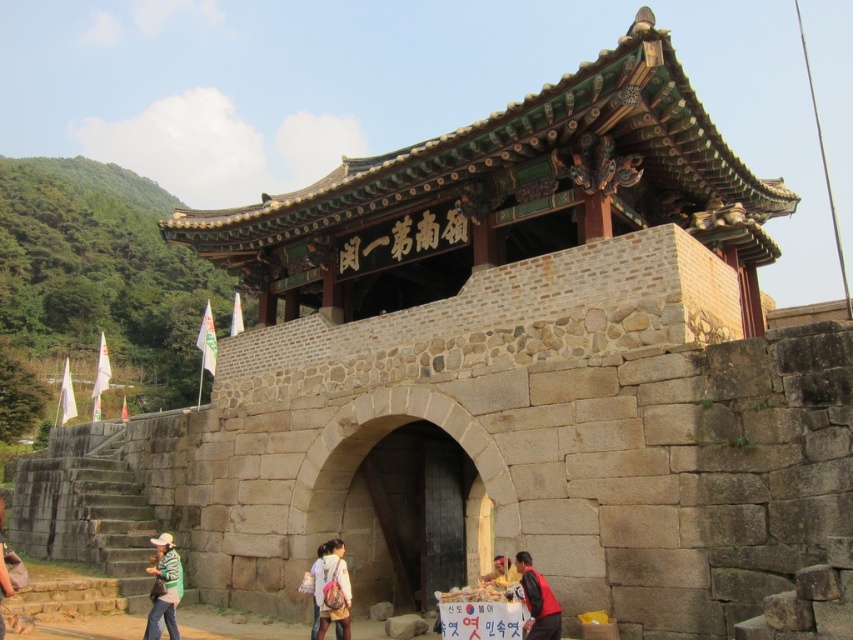
Question: Considering the real-world distances, which object is farthest from the green fabric bag at lower left?

Choices:
 (A) dark brown wood at center
 (B) light pink fabric backpack at lower center

Answer: (A)

Question: Can you confirm if dark red leather jacket at lower center is bigger than green fabric bag at lower left?

Choices:
 (A) yes
 (B) no

Answer: (B)

Question: Considering the relative positions of dark brown wood at center and dark red leather jacket at lower center in the image provided, where is dark brown wood at center located with respect to dark red leather jacket at lower center?

Choices:
 (A) below
 (B) above

Answer: (A)

Question: Estimate the real-world distances between objects in this image. Which object is farther from the dark red leather jacket at lower center?

Choices:
 (A) yellow fabric bag at center
 (B) green fabric bag at lower left
 (C) light pink fabric backpack at lower center
 (D) dark brown wood at center

Answer: (B)

Question: Among these objects, which one is nearest to the camera?

Choices:
 (A) green fabric bag at lower left
 (B) yellow fabric bag at center
 (C) green striped shirt at lower left

Answer: (A)

Question: Does green fabric bag at lower left have a smaller size compared to yellow fabric bag at center?

Choices:
 (A) yes
 (B) no

Answer: (B)